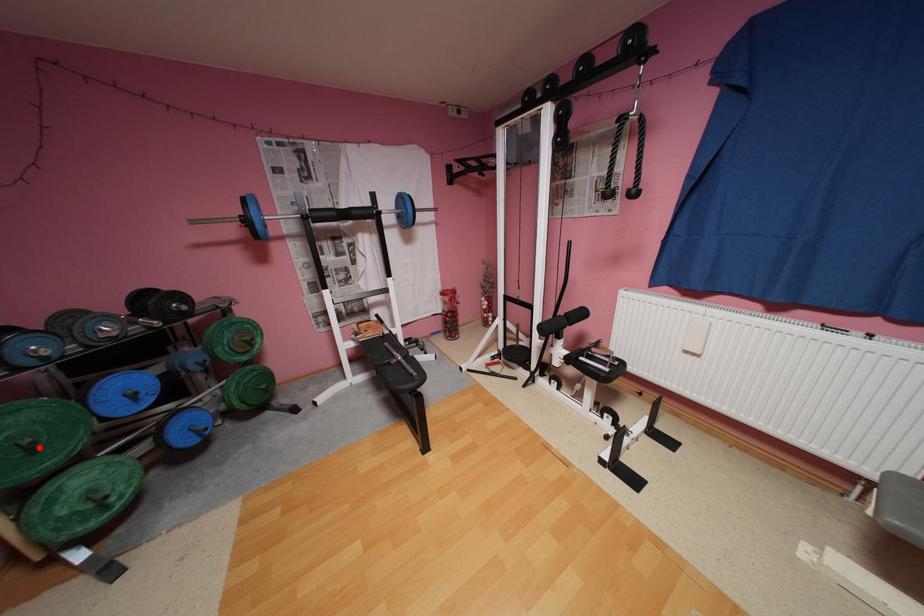
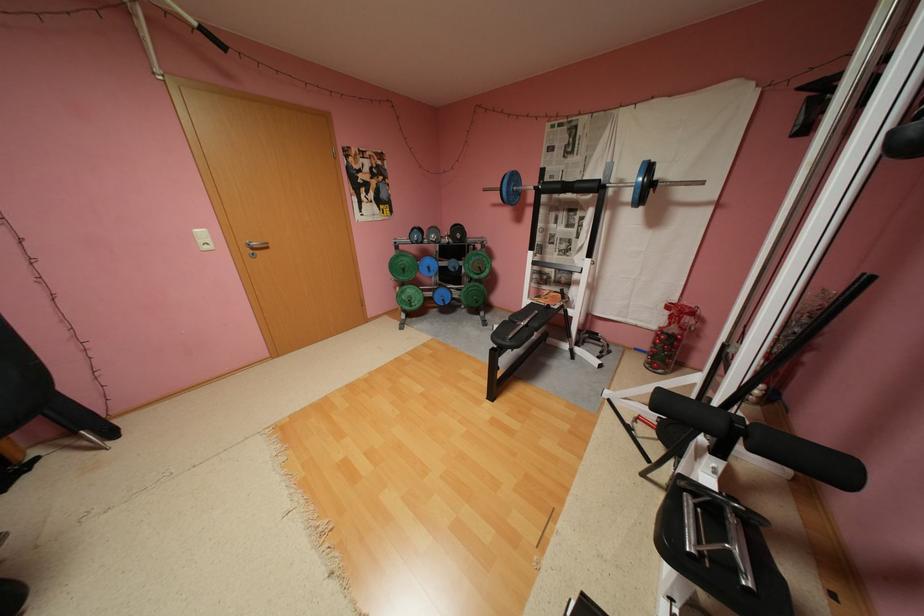
Question: A red point is marked in image1. In image2, is the corresponding 3D point closer to the camera or farther? Reply with the corresponding letter.

Choices:
 (A) The corresponding 3D point is closer.
 (B) The corresponding 3D point is farther.

Answer: (A)